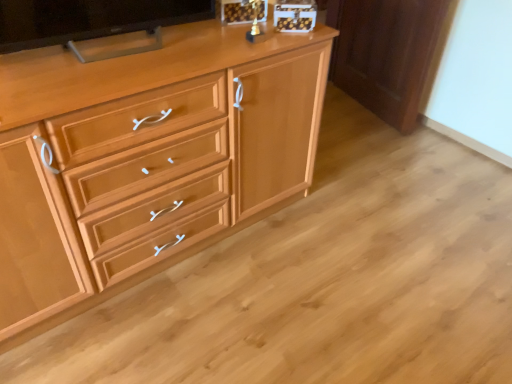
This screenshot has height=384, width=512. Identify the location of free area below light brown wood cabinet at right (from a real-world perspective). (361, 105).